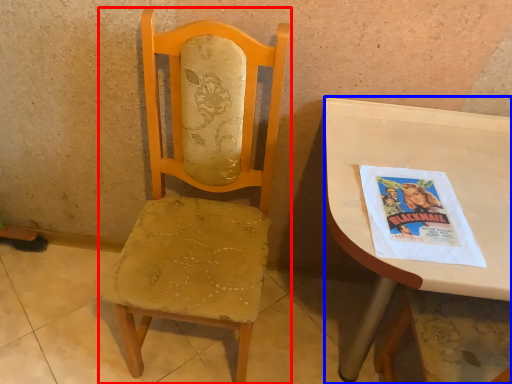
Question: Which point is further to the camera, chair (highlighted by a red box) or desk (highlighted by a blue box)?

Choices:
 (A) chair
 (B) desk

Answer: (B)